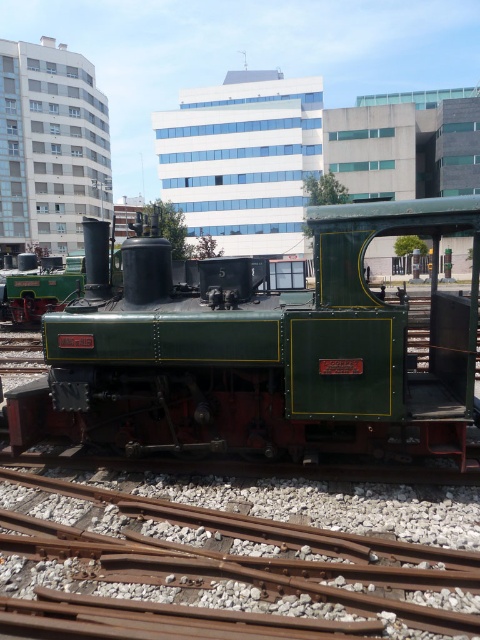
You are a photographer planning to take a picture of the green matte train at center and the rusty metal train track at lower center. If you want to focus on the train while keeping the track visible in the background, which object should be closer to the camera?

The green matte train at center should be closer to the camera because the rusty metal train track at lower center is behind it, allowing the track to remain visible in the background while focusing on the train.

You are standing in front of the green matte train at center. You want to take a photo of it with your smartphone, which has a maximum focus distance of 5 meters. Will your phone be able to focus on the train?

The green matte train at center is 4.98 meters from viewer, which is within the smartphone camera maximum focus distance of 5 meters. Therefore, the phone can focus on the train.

You are a city planner analyzing the image. The green matte train at center is represented by point (259, 349). What is the coordinate of the green matte train at center?

The coordinate of the green matte train at center is point (259, 349).